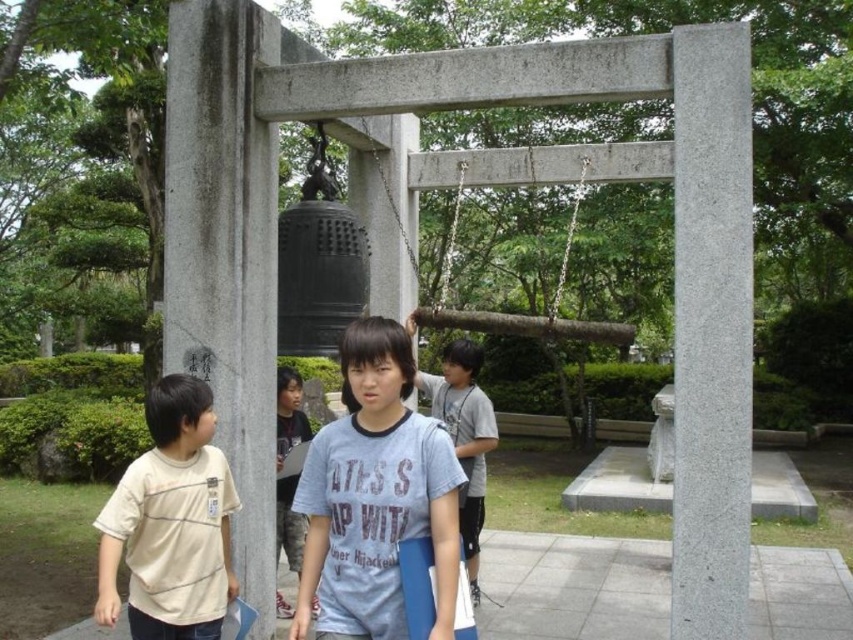
You are a photographer trying to capture a photo of the gray granite pillar at center and the light blue cotton shirt at center. Based on their sizes, which object should you focus on first to ensure it appears larger in the photo?

The gray granite pillar at center is taller than the light blue cotton shirt at center, so focusing on the gray granite pillar at center first will ensure it appears larger in the photo.